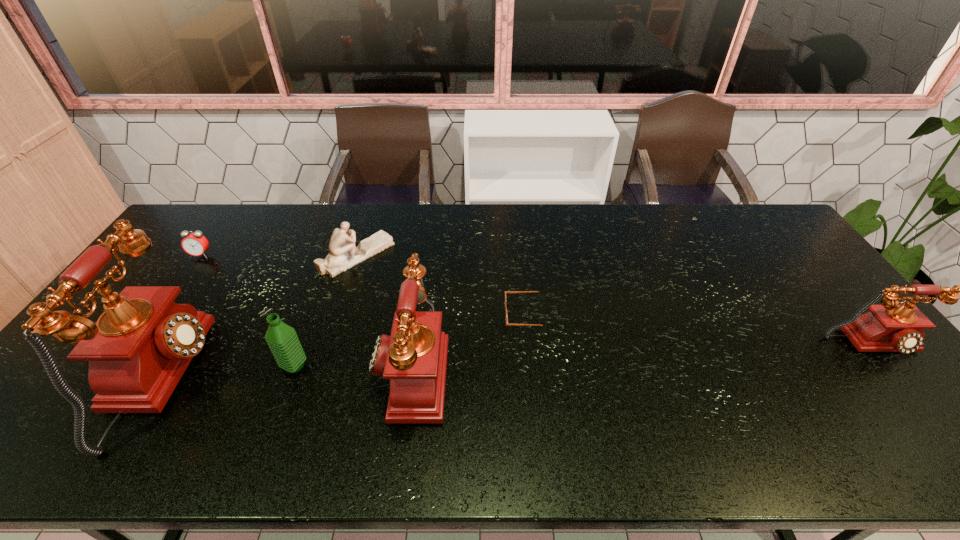
The image size is (960, 540). In order to click on vacant space situated on the dial of the leftmost telephone in this screenshot , I will do `click(348, 380)`.

This screenshot has width=960, height=540. Find the location of `vacant space located on the dial of the second shortest telephone`. vacant space located on the dial of the second shortest telephone is located at coordinates (225, 368).

Find the location of `free space located on the dial of the second shortest telephone`. free space located on the dial of the second shortest telephone is located at coordinates (357, 368).

Locate an element on the screen. vacant space located on the dial of the second shortest telephone is located at coordinates (306, 368).

Locate an element on the screen. vacant position located 0.140m on the dial of the rightmost object is located at coordinates (927, 413).

Where is `vacant space located 0.310m on the front-facing side of the alarm clock`? vacant space located 0.310m on the front-facing side of the alarm clock is located at coordinates (146, 333).

At what (x,y) coordinates should I click in order to perform the action: click on free space located 0.380m on the front-facing side of the third shortest object. Please return your answer as a coordinate pair (x, y). Looking at the image, I should click on (508, 255).

This screenshot has width=960, height=540. I want to click on free space located 0.330m on the back of the water bottle, so click(329, 271).

Where is `vacant space located 0.070m on the front-facing side of the sunglasses`? This screenshot has height=540, width=960. vacant space located 0.070m on the front-facing side of the sunglasses is located at coordinates (480, 315).

I want to click on vacant space located on the front-facing side of the sunglasses, so click(467, 315).